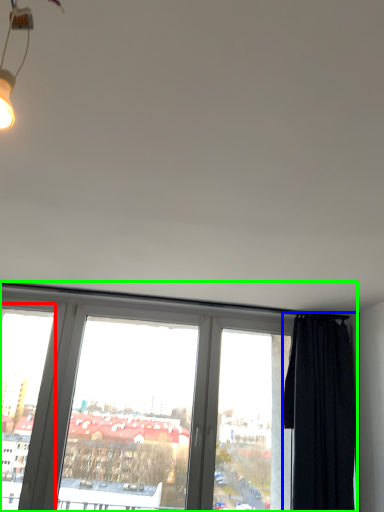
Question: Which is nearer to the window frame (highlighted by a red box)? curtain (highlighted by a blue box) or window (highlighted by a green box).

Choices:
 (A) curtain
 (B) window

Answer: (B)